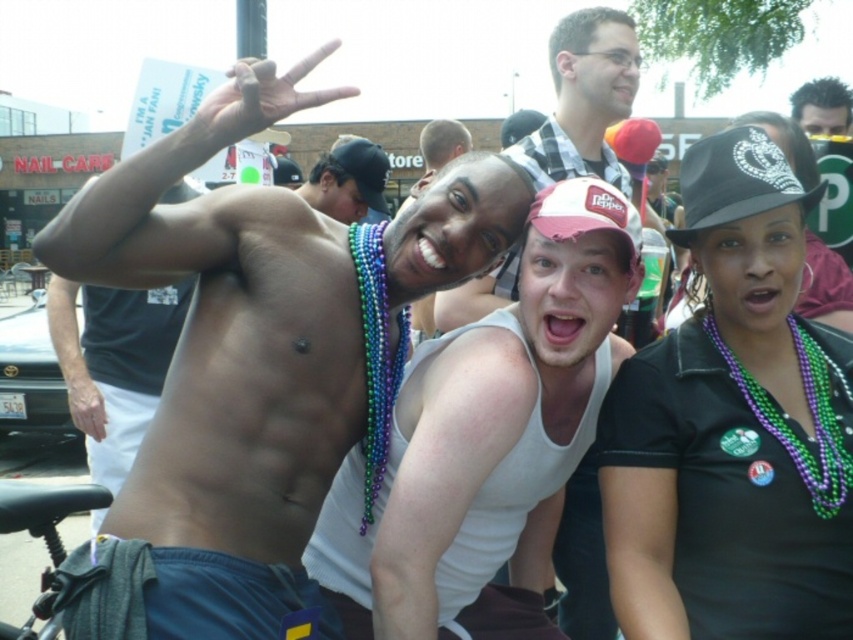
Question: Which point is closer to the camera taking this photo?

Choices:
 (A) (572, 221)
 (B) (636, 42)

Answer: (A)

Question: Can you confirm if black matte hat at upper right is thinner than white cotton shirt at center?

Choices:
 (A) yes
 (B) no

Answer: (B)

Question: Estimate the real-world distances between objects in this image. Which object is closer to the white fabric baseball cap at center?

Choices:
 (A) green beaded necklace at lower right
 (B) dark brown hair at upper right
 (C) black sequined baseball cap at upper right
 (D) white cotton shirt at center

Answer: (C)

Question: Does white cotton shirt at center have a smaller size compared to black sequined baseball cap at upper right?

Choices:
 (A) no
 (B) yes

Answer: (A)

Question: Which point is farther to the camera?

Choices:
 (A) dark brown hair at upper right
 (B) white fabric baseball cap at center
 (C) white cotton shirt at center
 (D) green beaded necklace at lower right

Answer: (A)

Question: In this image, where is white cotton shirt at center located relative to white fabric baseball cap at center?

Choices:
 (A) left
 (B) right

Answer: (B)